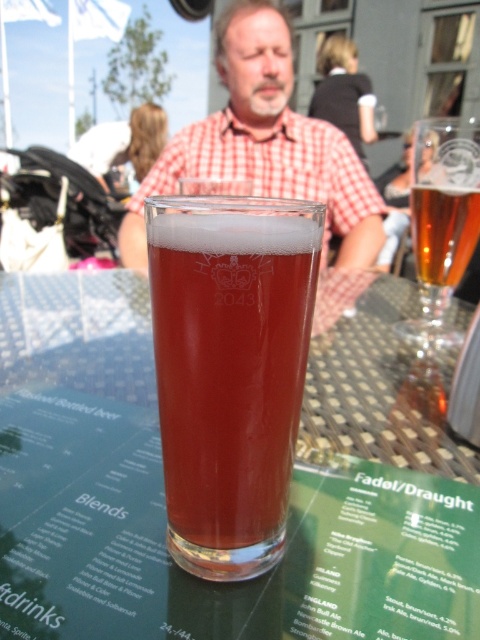
Between point (55, 368) and point (463, 147), which one is positioned behind?

The point (463, 147) is more distant.

Does translucent glass at center have a larger size compared to clear glass beer at upper right?

Correct, translucent glass at center is larger in size than clear glass beer at upper right.

Does point (316, 436) lie in front of point (442, 216)?

Yes, point (316, 436) is closer to viewer.

Find the location of a particular element. The width and height of the screenshot is (480, 640). translucent glass at center is located at coordinates (163, 493).

Which is more to the left, translucent amber glass at center or amber glass beer at upper right?

translucent amber glass at center is more to the left.

Does translucent amber glass at center have a greater height compared to amber glass beer at upper right?

Correct, translucent amber glass at center is much taller as amber glass beer at upper right.

Does point (181, 563) come behind point (432, 257)?

No, it is not.

The image size is (480, 640). In order to click on translucent amber glass at center in this screenshot , I will do `click(229, 369)`.

Between translucent glass at center and amber glass beer at upper right, which one appears on the right side from the viewer's perspective?

amber glass beer at upper right

Can you confirm if translucent glass at center is positioned above amber glass beer at upper right?

No, translucent glass at center is not above amber glass beer at upper right.

Does point (359, 579) come farther from viewer compared to point (450, 275)?

No.

Where is `translucent glass at center`? The image size is (480, 640). translucent glass at center is located at coordinates (163, 493).